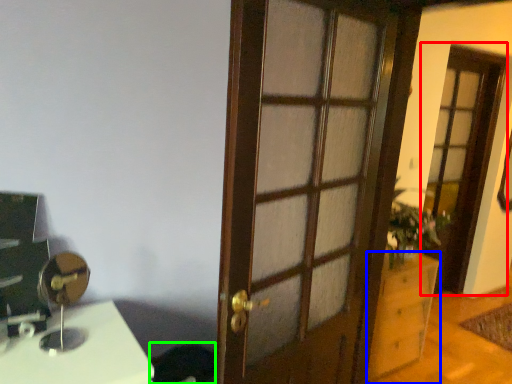
Question: Which object is the farthest from screen door (highlighted by a red box)? Choose among these: cabinetry (highlighted by a blue box) or swivel chair (highlighted by a green box).

Choices:
 (A) cabinetry
 (B) swivel chair

Answer: (B)